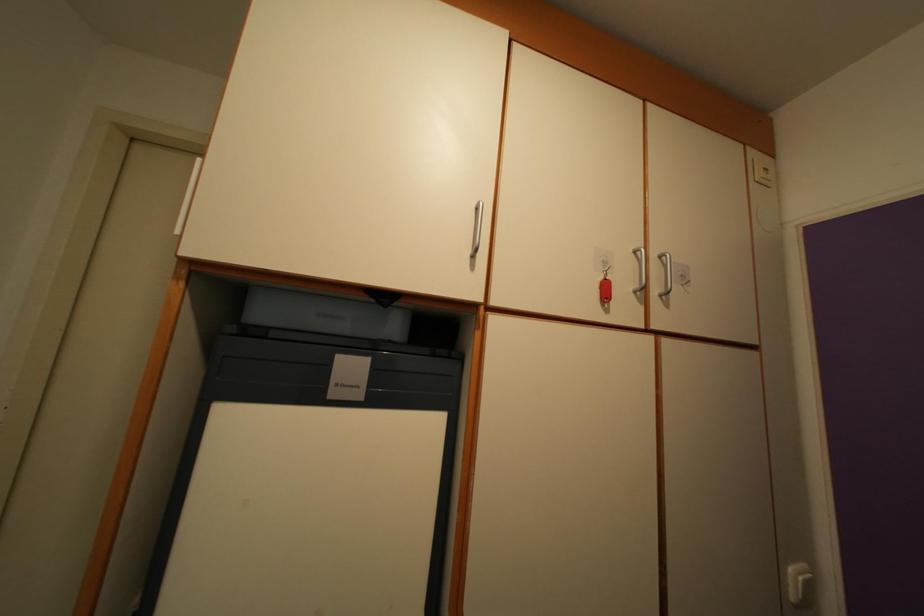
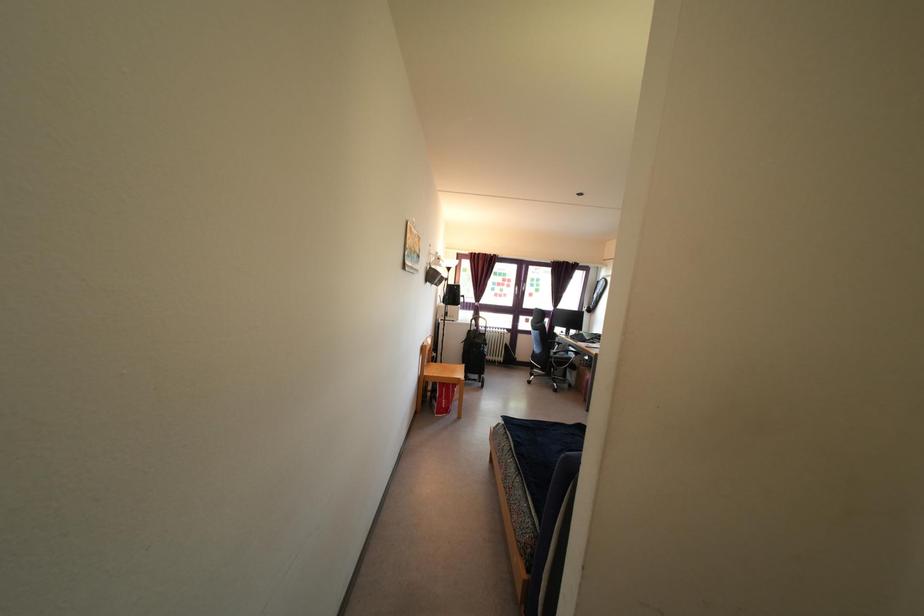
Question: The images are taken continuously from a first-person perspective. In which direction is your viewpoint rotating?

Choices:
 (A) Left
 (B) Right
 (C) Up
 (D) Down

Answer: (A)